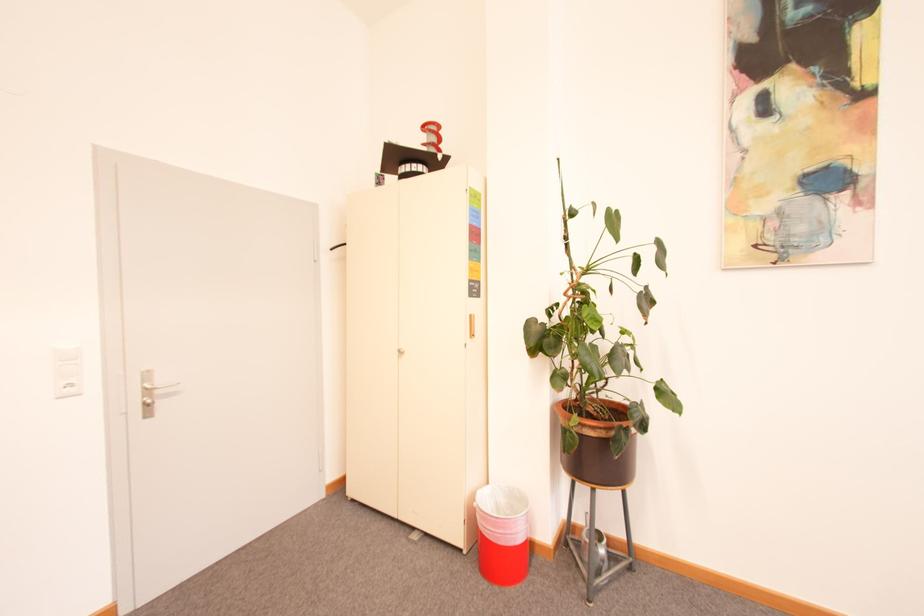
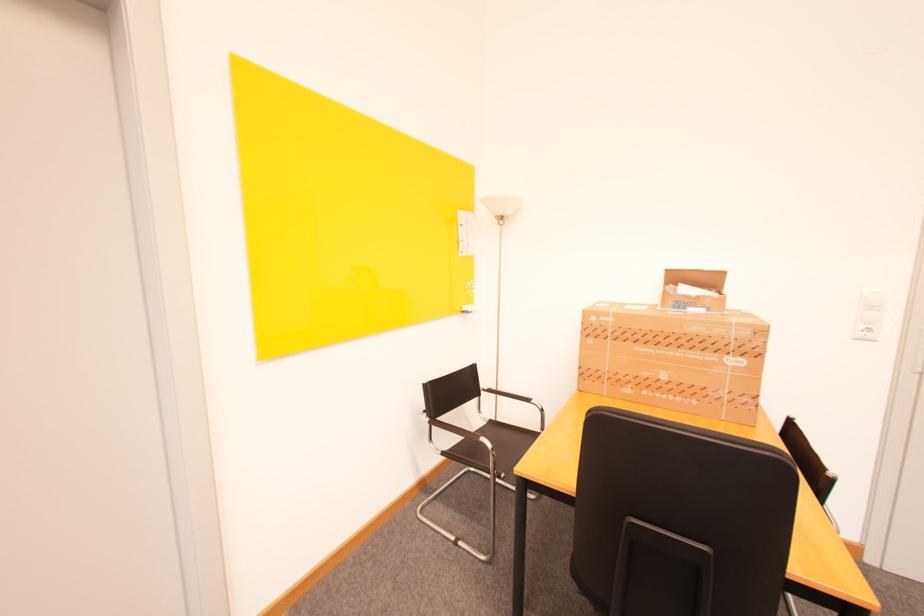
Locate, in the second image, the point that corresponds to pixel 66 399 in the first image.

(862, 339)